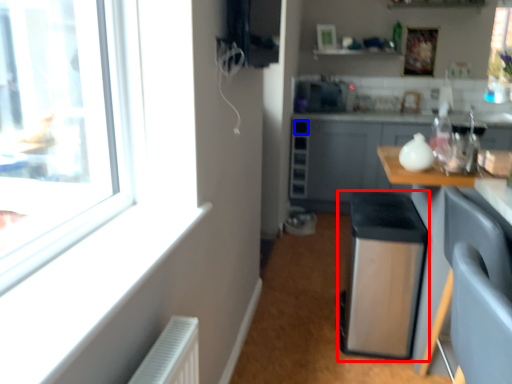
Question: Which of the following is the farthest to the observer, water heater (highlighted by a red box) or drawer (highlighted by a blue box)?

Choices:
 (A) water heater
 (B) drawer

Answer: (B)